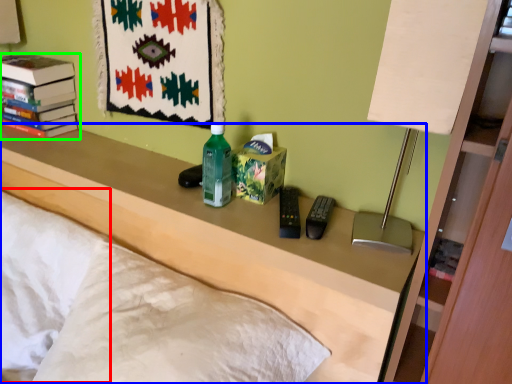
Question: Which is nearer to the pillow (highlighted by a red box)? furniture (highlighted by a blue box) or book (highlighted by a green box).

Choices:
 (A) furniture
 (B) book

Answer: (A)